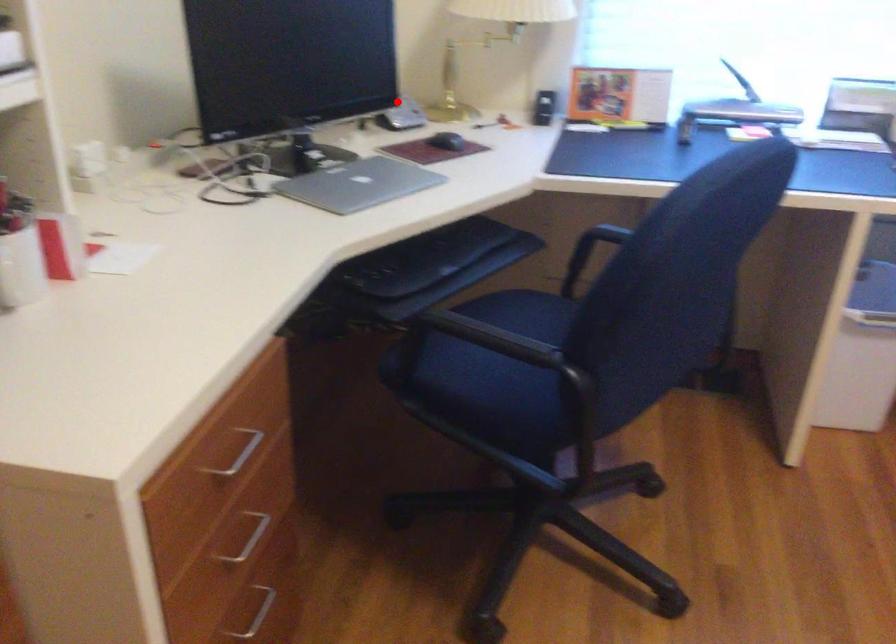
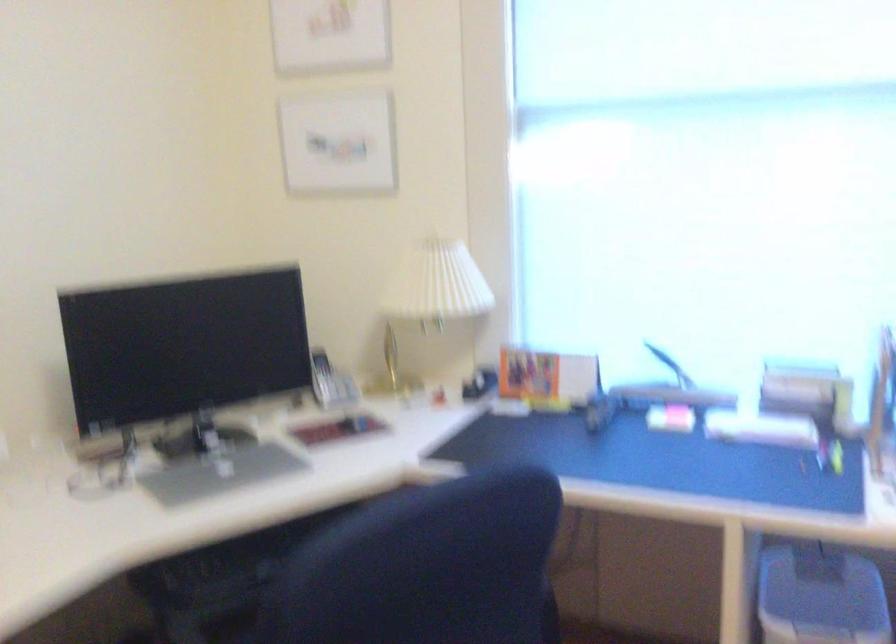
In the second image, find the point that corresponds to the highlighted location in the first image.

(330, 382)